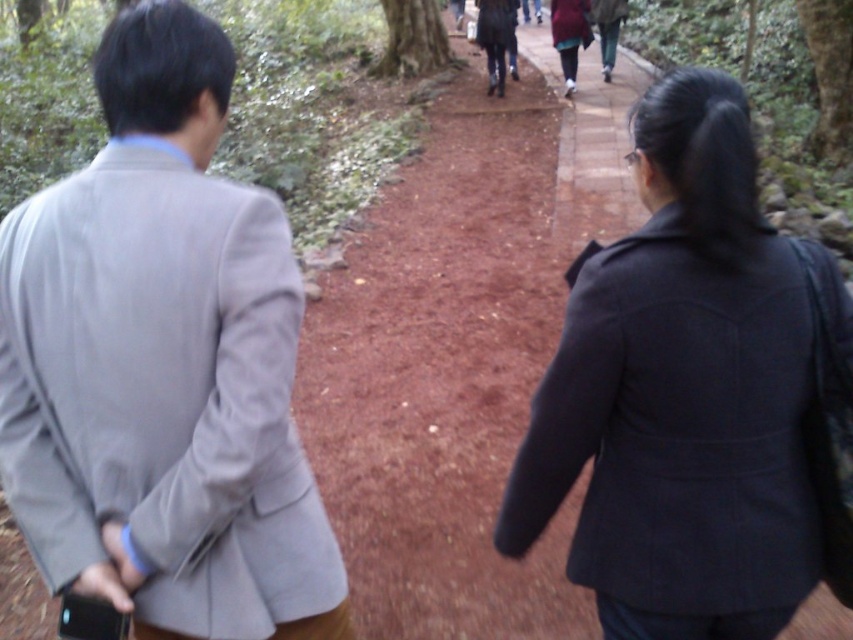
Is light gray suit at left shorter than matte black coat at center?

No.

Is point (180, 368) positioned after point (514, 474)?

No.

Where is `light gray suit at left`? light gray suit at left is located at coordinates (161, 364).

Between matte black coat at center and dark red fabric coat at center, which one has more height?

dark red fabric coat at center

Does point (641, 390) lie in front of point (556, 51)?

That is True.

Locate an element on the screen. matte black coat at center is located at coordinates (682, 394).

Is matte black coat at center positioned at the back of maroon fabric coat at center?

No.

Between point (751, 456) and point (550, 16), which one is positioned in front?

Point (751, 456)

Find the location of a particular element. This screenshot has width=853, height=640. matte black coat at center is located at coordinates (682, 394).